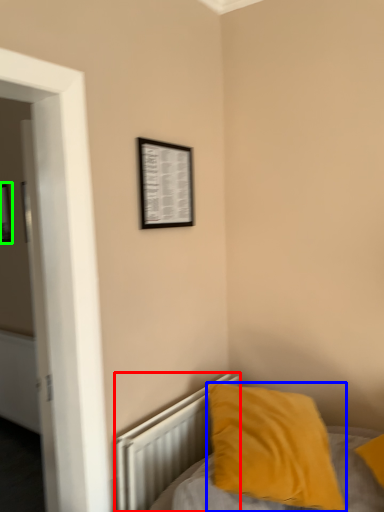
Question: Which is farther away from radiator (highlighted by a red box)? pillow (highlighted by a blue box) or picture frame (highlighted by a green box)?

Choices:
 (A) pillow
 (B) picture frame

Answer: (B)